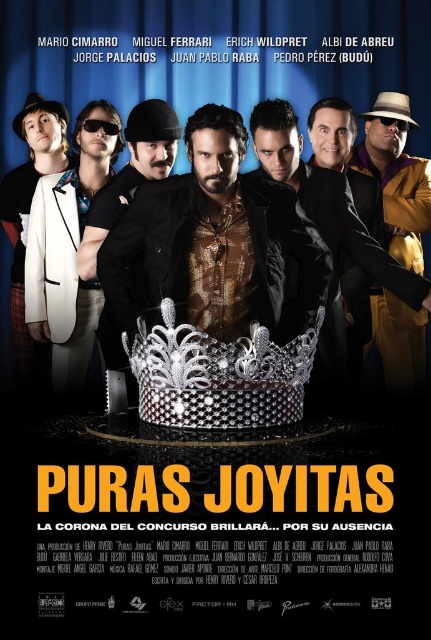
Is silver metallic crown at center wider than sunglasses at left?

In fact, silver metallic crown at center might be narrower than sunglasses at left.

Which is in front, point (190, 369) or point (37, 244)?

Positioned in front is point (190, 369).

This screenshot has width=431, height=640. I want to click on silver metallic crown at center, so click(x=218, y=376).